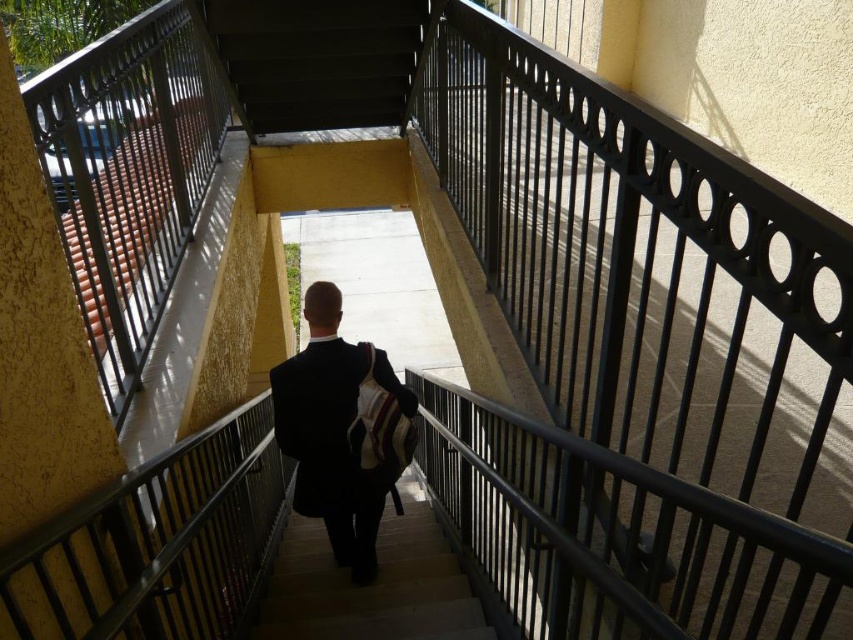
You are a photographer trying to capture a candid shot of the person in the dark suit at center. Your camera is positioned at a certain distance. Can you estimate whether you can comfortably frame the person in your shot without moving the camera? The camera has a standard 50mm lens.

The dark suit at center and camera are 8.30 feet apart. With a standard 50mm lens, this distance allows for a comfortable framing of the subject, as 8.3 feet is within the typical focusing range for such a lens, enabling clear capture without needing to adjust the camera position.